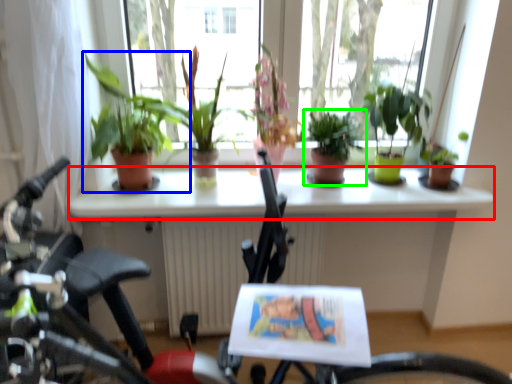
Question: Considering the real-world distances, which object is closest to window sill (highlighted by a red box)? houseplant (highlighted by a blue box) or houseplant (highlighted by a green box).

Choices:
 (A) houseplant
 (B) houseplant

Answer: (B)